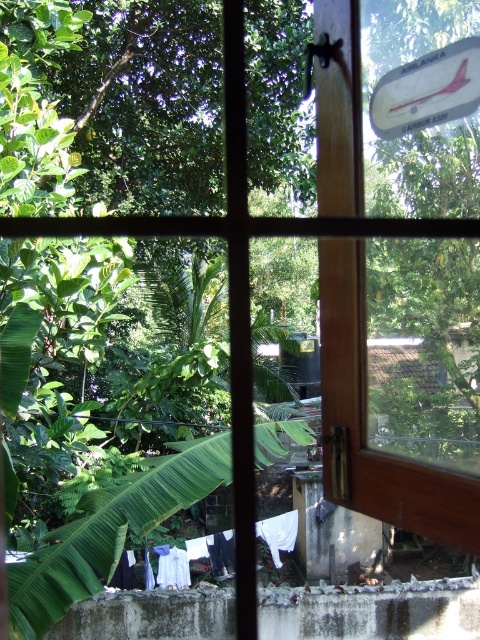
Is point (462, 77) closer to viewer compared to point (294, 536)?

Yes, point (462, 77) is closer to viewer.

Is metallic reflective airplane at upper right positioned at the back of white fabric at lower center?

No.

Which is in front, point (471, 65) or point (202, 568)?

Point (471, 65) is more forward.

Locate an element on the screen. metallic reflective airplane at upper right is located at coordinates (428, 90).